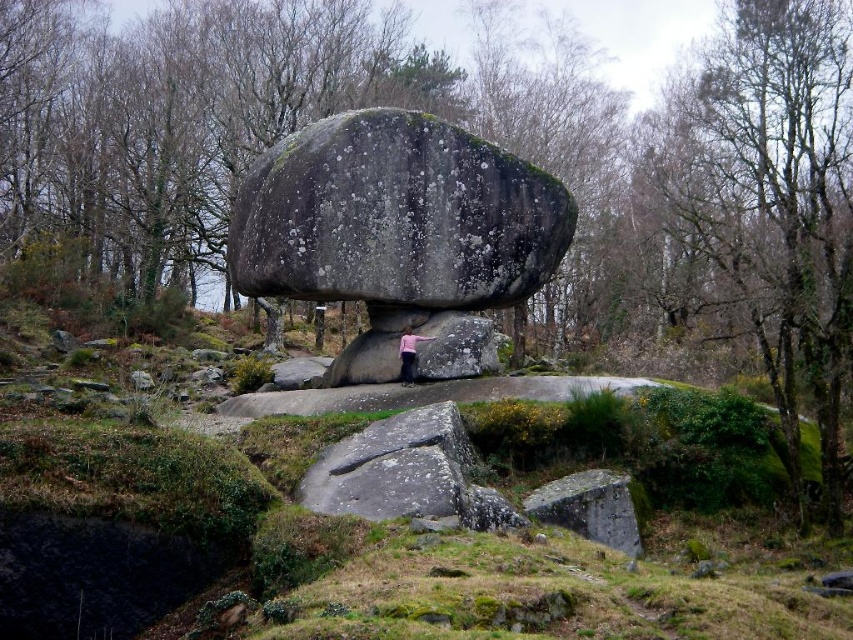
You are a hiker trying to determine the best spot to place your pink fabric at center for a photo. Considering the green mossy rock at center, which object is bigger and should you avoid placing the fabric too close to prevent overshadowing?

The green mossy rock at center is larger in size compared to the pink fabric at center. To prevent overshadowing, avoid placing the pink fabric at center too close to the green mossy rock at center since it is bigger.